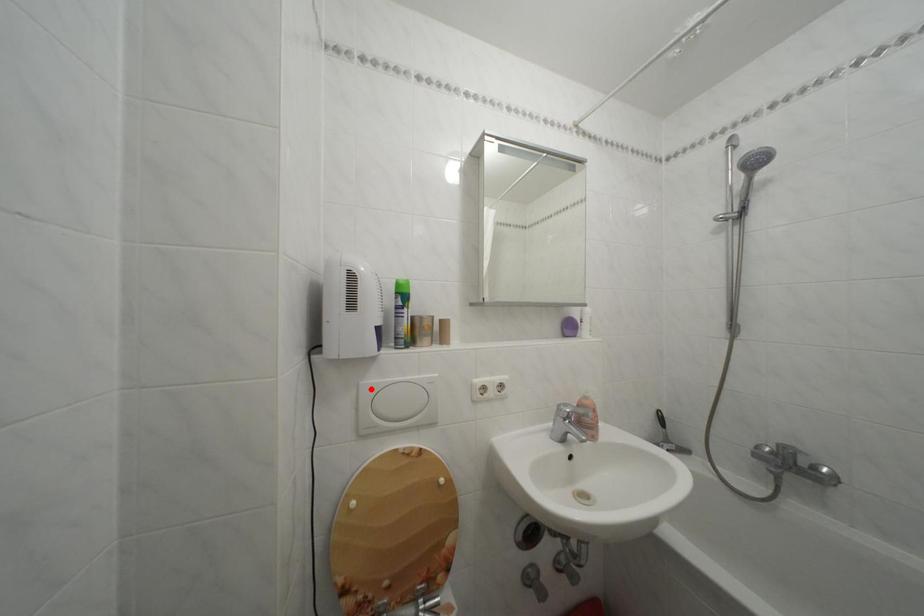
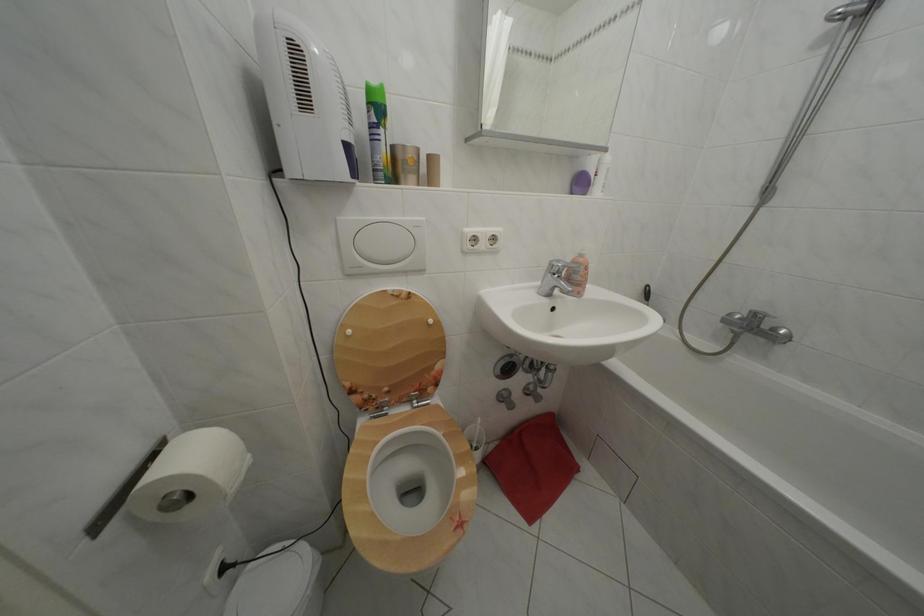
The point at the highlighted location is marked in the first image. Where is the corresponding point in the second image?

(348, 225)